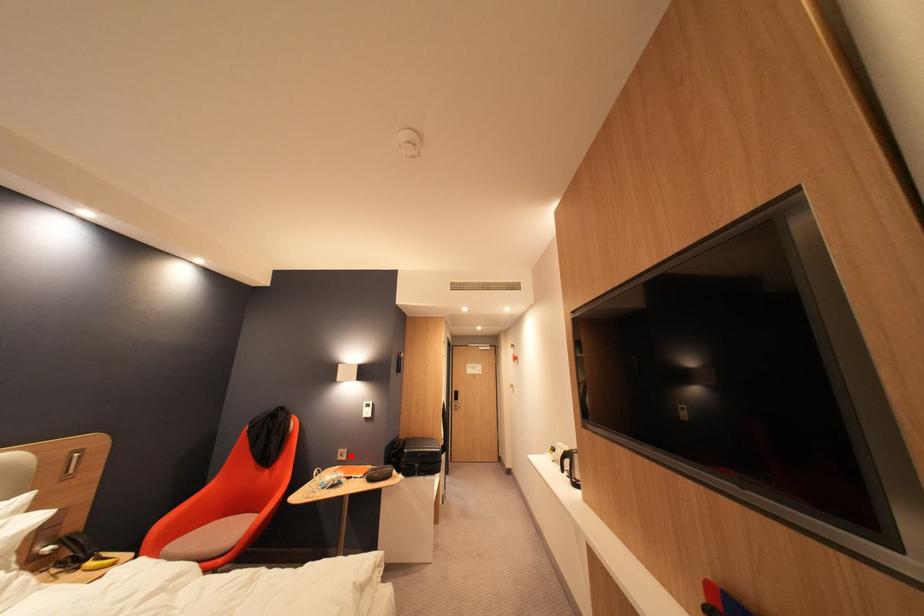
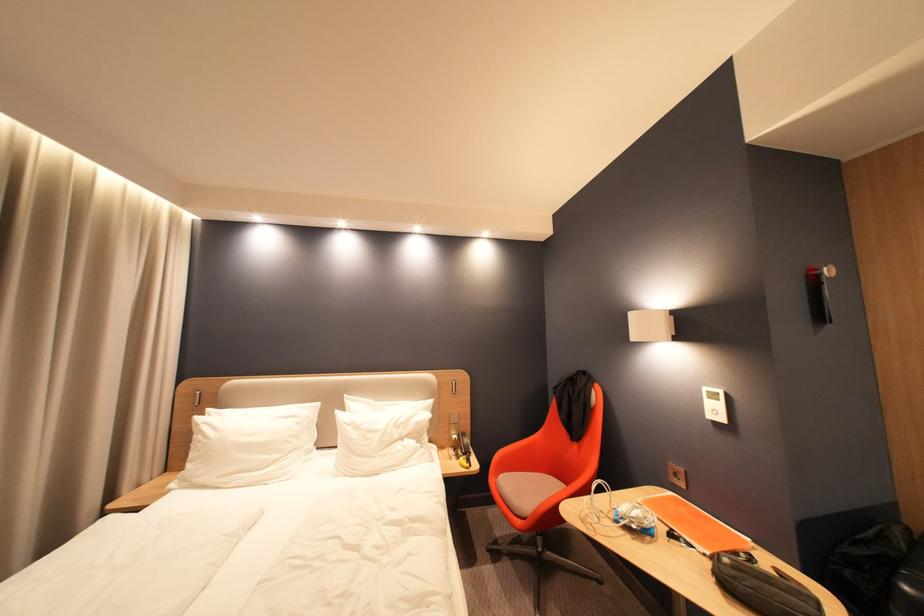
Question: I am providing you with two images of the same scene from different viewpoints. Image1 has a red point marked. In image2, the corresponding 3D location appears at what relative position? Reply with the corresponding letter.

Choices:
 (A) Closer
 (B) Farther

Answer: (A)